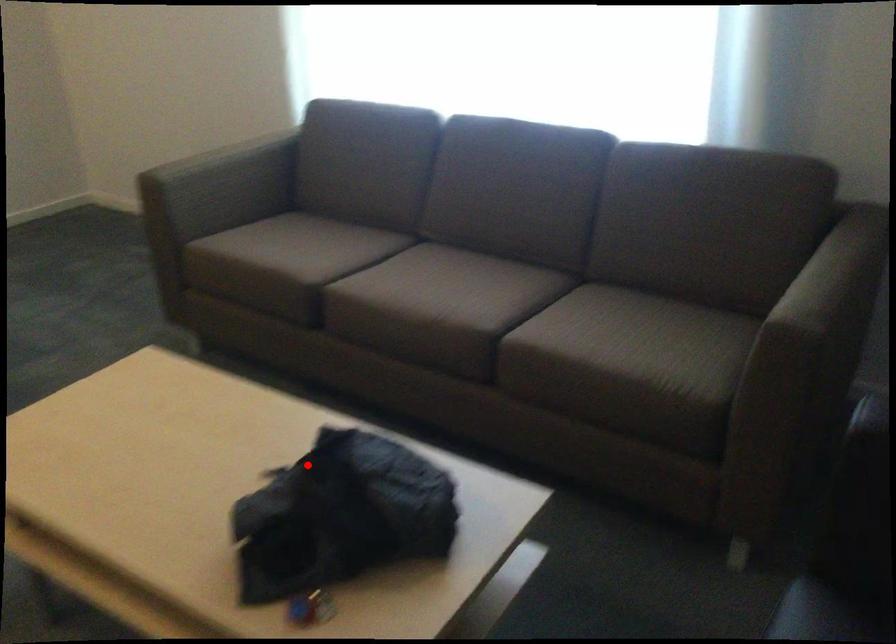
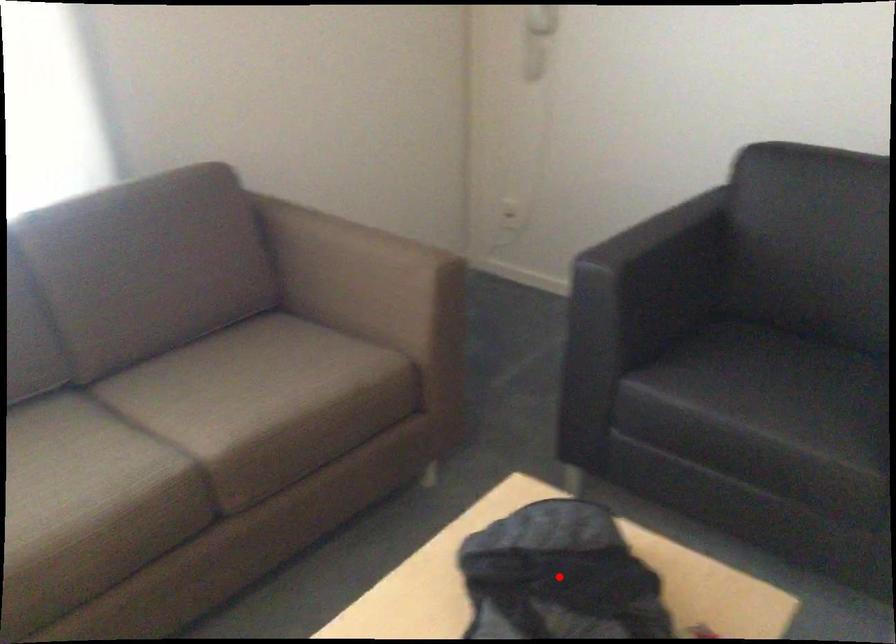
I am providing you with two images of the same scene from different viewpoints. A red point is marked on the first image and another point is marked on the second image. Is the marked point in image1 the same physical position as the marked point in image2?

Yes